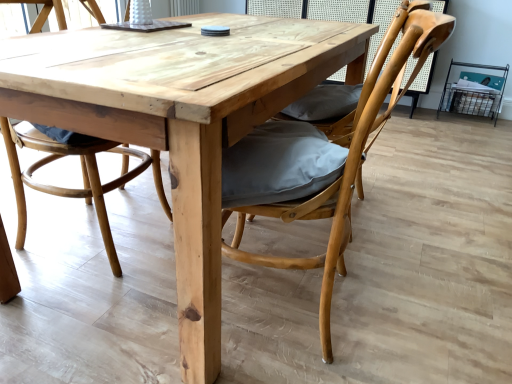
Where is `spots to the right of natural wood chair at center, which appears as the first chair when viewed from the right`? The height and width of the screenshot is (384, 512). spots to the right of natural wood chair at center, which appears as the first chair when viewed from the right is located at coordinates (436, 293).